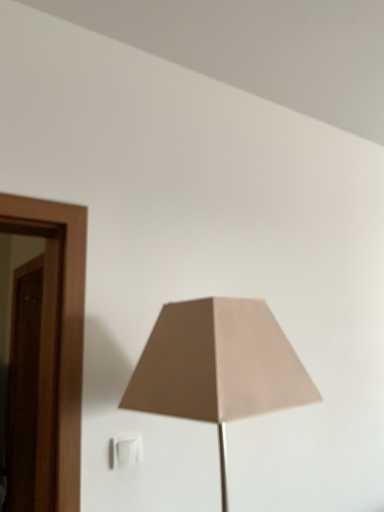
Question: From a real-world perspective, is white plastic electric outlet at lower center beneath beige fabric lampshade at center?

Choices:
 (A) yes
 (B) no

Answer: (A)

Question: Does white plastic electric outlet at lower center have a lesser width compared to beige fabric lampshade at center?

Choices:
 (A) no
 (B) yes

Answer: (B)

Question: Does white plastic electric outlet at lower center turn towards beige fabric lampshade at center?

Choices:
 (A) yes
 (B) no

Answer: (A)

Question: Does white plastic electric outlet at lower center have a lesser height compared to beige fabric lampshade at center?

Choices:
 (A) yes
 (B) no

Answer: (A)

Question: From a real-world perspective, is white plastic electric outlet at lower center over beige fabric lampshade at center?

Choices:
 (A) yes
 (B) no

Answer: (B)

Question: Is white plastic electric outlet at lower center facing away from beige fabric lampshade at center?

Choices:
 (A) no
 (B) yes

Answer: (A)

Question: From the image's perspective, does beige fabric lampshade at center appear lower than white plastic electric outlet at lower center?

Choices:
 (A) yes
 (B) no

Answer: (B)

Question: Does beige fabric lampshade at center have a greater height compared to white plastic electric outlet at lower center?

Choices:
 (A) yes
 (B) no

Answer: (A)

Question: Can you confirm if beige fabric lampshade at center is positioned to the right of white plastic electric outlet at lower center?

Choices:
 (A) yes
 (B) no

Answer: (A)

Question: Is beige fabric lampshade at center wider than white plastic electric outlet at lower center?

Choices:
 (A) yes
 (B) no

Answer: (A)

Question: Is beige fabric lampshade at center in front of white plastic electric outlet at lower center?

Choices:
 (A) yes
 (B) no

Answer: (A)

Question: From a real-world perspective, does beige fabric lampshade at center sit lower than white plastic electric outlet at lower center?

Choices:
 (A) no
 (B) yes

Answer: (A)

Question: Is beige fabric lampshade at center situated inside white plastic electric outlet at lower center or outside?

Choices:
 (A) outside
 (B) inside

Answer: (A)